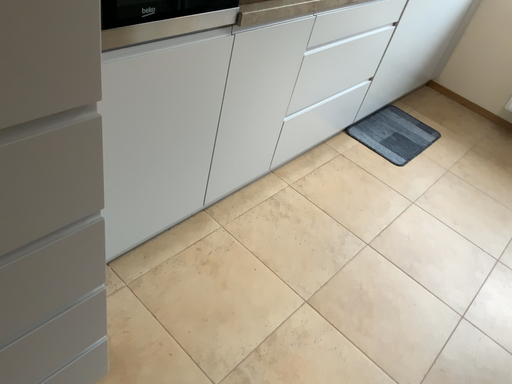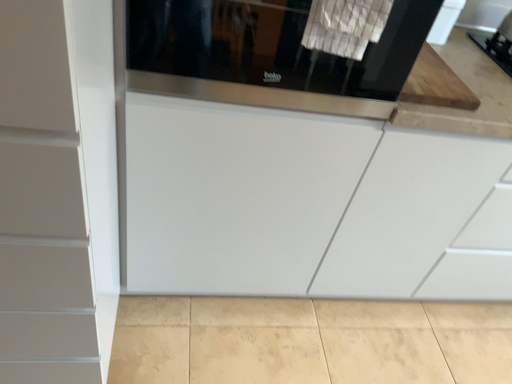
Question: How did the camera likely rotate when shooting the video?

Choices:
 (A) rotated right
 (B) rotated left

Answer: (B)